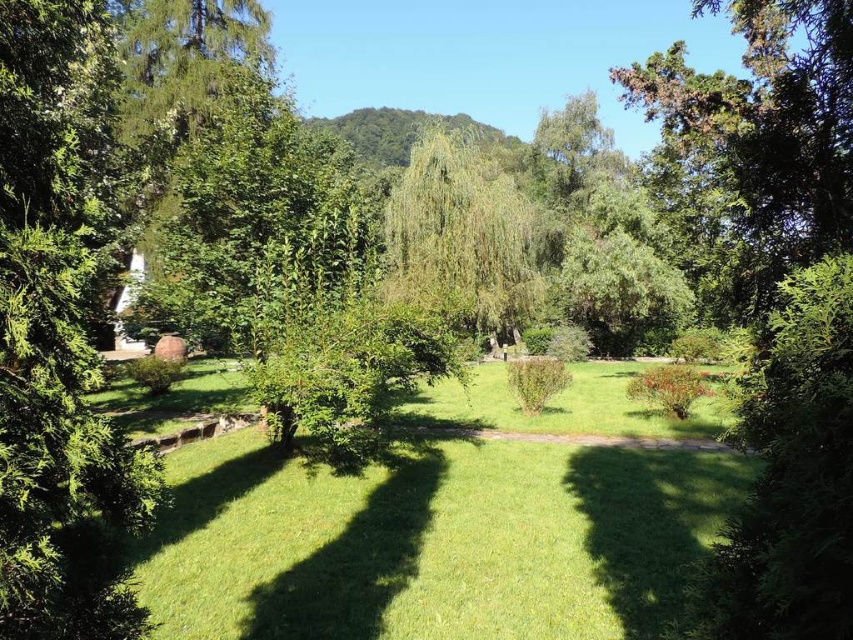
You are a gardener who wants to plant a new flower bed between the green grass at center and the green leafy tree at center. Based on their positions, where should the flower bed be placed?

The flower bed should be placed above the green grass at center since it is below the green leafy tree at center, so placing it above the grass would position it between them.

You are a gardener planning to place a 3m wide decorative fountain in the garden. Based on the scene, can the green grass at center accommodate the fountain without overlapping the green leafy tree at center?

The green grass at center might be wider than green leafy tree at center, so there is a possibility that the 3m wide fountain can be placed on the green grass at center without overlapping the tree. However, since the exact width difference isn not specified, it requires further measurement to confirm.